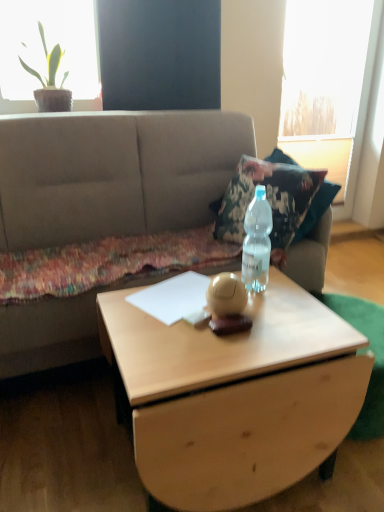
Question: Is light wood coffee table at center with green leafy plant at upper left?

Choices:
 (A) yes
 (B) no

Answer: (B)

Question: Does light wood coffee table at center have a smaller size compared to green leafy plant at upper left?

Choices:
 (A) yes
 (B) no

Answer: (B)

Question: Considering the relative positions of light wood coffee table at center and green leafy plant at upper left in the image provided, is light wood coffee table at center to the left of green leafy plant at upper left from the viewer's perspective?

Choices:
 (A) yes
 (B) no

Answer: (B)

Question: Can you confirm if light wood coffee table at center is shorter than green leafy plant at upper left?

Choices:
 (A) no
 (B) yes

Answer: (B)

Question: Is the position of light wood coffee table at center less distant than that of green leafy plant at upper left?

Choices:
 (A) no
 (B) yes

Answer: (B)

Question: Relative to beige fabric couch at center, is clear plastic bottle at center in front or behind?

Choices:
 (A) behind
 (B) front

Answer: (A)

Question: Is point (266, 242) positioned closer to the camera than point (69, 337)?

Choices:
 (A) farther
 (B) closer

Answer: (B)

Question: From a real-world perspective, is clear plastic bottle at center positioned above or below beige fabric couch at center?

Choices:
 (A) below
 (B) above

Answer: (B)

Question: Do you think clear plastic bottle at center is within beige fabric couch at center, or outside of it?

Choices:
 (A) inside
 (B) outside

Answer: (B)

Question: Is point (264, 241) closer or farther from the camera than point (193, 417)?

Choices:
 (A) farther
 (B) closer

Answer: (A)

Question: From the image's perspective, relative to light wood coffee table at center, is clear plastic bottle at center above or below?

Choices:
 (A) above
 (B) below

Answer: (A)

Question: In terms of width, does clear plastic bottle at center look wider or thinner when compared to light wood coffee table at center?

Choices:
 (A) thin
 (B) wide

Answer: (A)

Question: Based on their sizes in the image, would you say clear plastic bottle at center is bigger or smaller than light wood coffee table at center?

Choices:
 (A) small
 (B) big

Answer: (A)

Question: From a real-world perspective, relative to clear plastic bottle at center, is green leafy plant at upper left vertically above or below?

Choices:
 (A) below
 (B) above

Answer: (B)

Question: Looking at the image, does green leafy plant at upper left seem bigger or smaller compared to clear plastic bottle at center?

Choices:
 (A) small
 (B) big

Answer: (B)